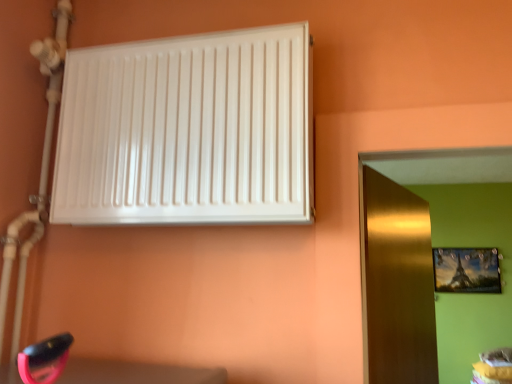
Question: Considering the relative positions of metallic gold picture frame at upper right and gold metallic door at right in the image provided, is metallic gold picture frame at upper right to the left or to the right of gold metallic door at right?

Choices:
 (A) left
 (B) right

Answer: (B)

Question: Do you think metallic gold picture frame at upper right is within gold metallic door at right, or outside of it?

Choices:
 (A) inside
 (B) outside

Answer: (B)

Question: Which is nearer to the gold metallic door at right?

Choices:
 (A) white glossy radiator at upper left
 (B) metallic gold picture frame at upper right

Answer: (A)

Question: Which object is positioned farthest from the metallic gold picture frame at upper right?

Choices:
 (A) gold metallic door at right
 (B) white glossy radiator at upper left

Answer: (B)